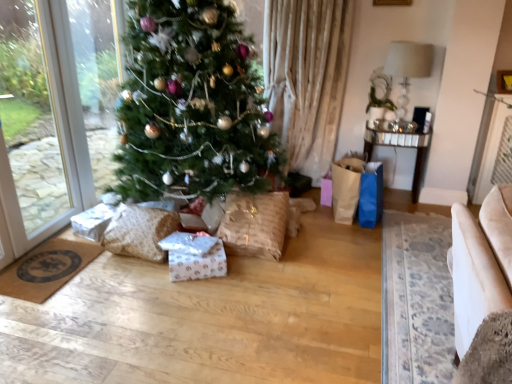
Question: Is white glossy paper at center smaller than burlap wrapped gift at center, the 2th pillow when ordered from left to right?

Choices:
 (A) no
 (B) yes

Answer: (B)

Question: From a real-world perspective, is white glossy paper at center under burlap wrapped gift at center, the 2th pillow when ordered from left to right?

Choices:
 (A) no
 (B) yes

Answer: (B)

Question: From a real-world perspective, does white glossy paper at center stand above burlap wrapped gift at center, the 1th pillow viewed from the right?

Choices:
 (A) no
 (B) yes

Answer: (A)

Question: Does white glossy paper at center have a lesser width compared to burlap wrapped gift at center, the 1th pillow viewed from the right?

Choices:
 (A) no
 (B) yes

Answer: (B)

Question: Can you confirm if white glossy paper at center is taller than burlap wrapped gift at center, the 1th pillow viewed from the right?

Choices:
 (A) yes
 (B) no

Answer: (B)

Question: Is burlap wrapped gift at center, the 2th pillow when ordered from left to right, at the back of white glossy paper at center?

Choices:
 (A) yes
 (B) no

Answer: (B)

Question: Does beige fabric armchair at lower right appear on the left side of mirrored glass table at right?

Choices:
 (A) yes
 (B) no

Answer: (B)

Question: Is beige fabric armchair at lower right thinner than mirrored glass table at right?

Choices:
 (A) no
 (B) yes

Answer: (A)

Question: Is beige fabric armchair at lower right positioned behind mirrored glass table at right?

Choices:
 (A) yes
 (B) no

Answer: (B)

Question: Is beige fabric armchair at lower right outside mirrored glass table at right?

Choices:
 (A) no
 (B) yes

Answer: (B)

Question: From a real-world perspective, is beige fabric armchair at lower right positioned over mirrored glass table at right based on gravity?

Choices:
 (A) no
 (B) yes

Answer: (A)

Question: From the image's perspective, is beige fabric armchair at lower right below mirrored glass table at right?

Choices:
 (A) no
 (B) yes

Answer: (B)

Question: Considering the relative sizes of burlap wrapped gift at center, the 2th pillow when ordered from left to right, and textured beige pillow at lower left, the second pillow from the right, in the image provided, is burlap wrapped gift at center, the 2th pillow when ordered from left to right, shorter than textured beige pillow at lower left, the second pillow from the right,?

Choices:
 (A) no
 (B) yes

Answer: (A)